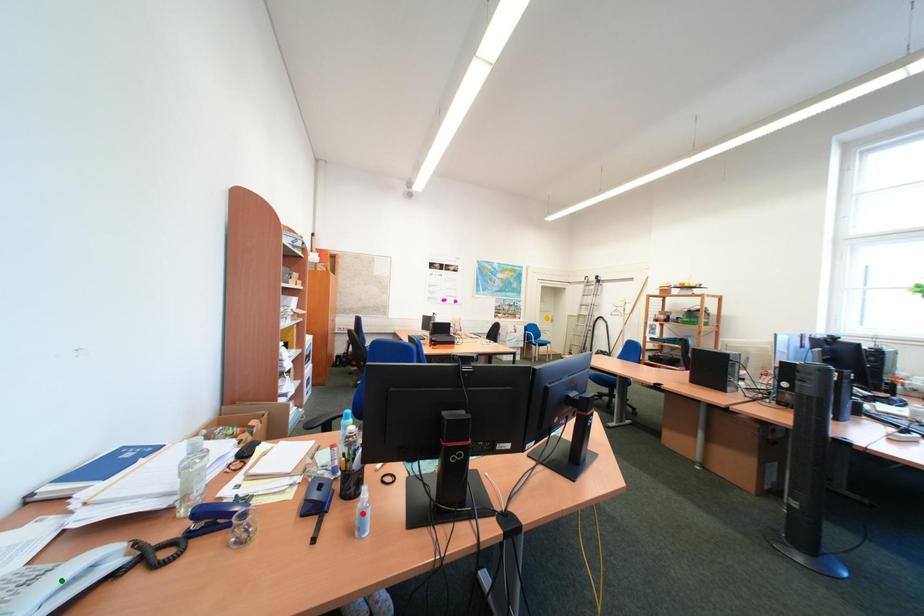
Order these from nearest to farthest:
A) green point
B) red point
C) orange point

1. green point
2. red point
3. orange point